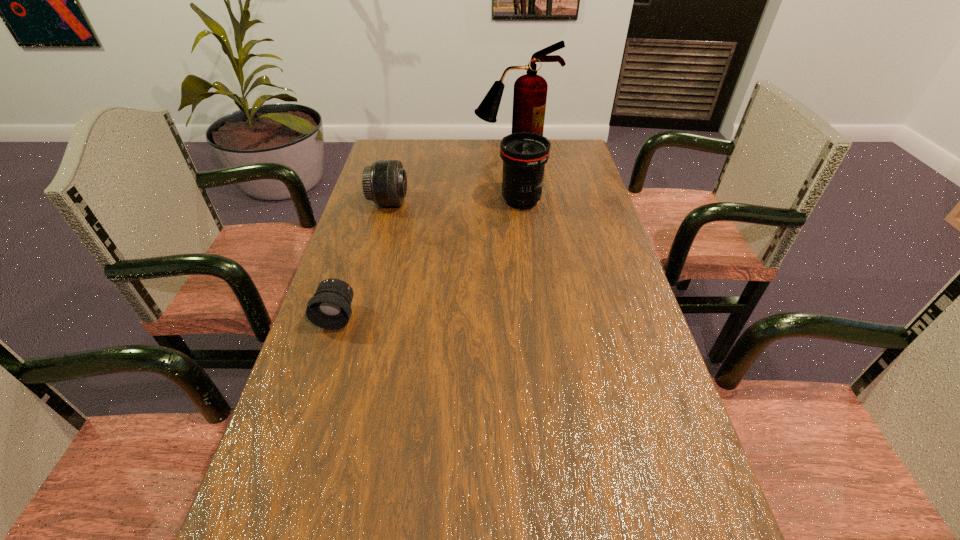
Where is `unoccupied area between the farthest object and the nearest object`? This screenshot has width=960, height=540. unoccupied area between the farthest object and the nearest object is located at coordinates (426, 233).

Locate an element on the screen. free spot between the nearest object and the tallest telephoto lens is located at coordinates (429, 259).

Find the location of `free area in between the second tallest telephoto lens and the shortest object`. free area in between the second tallest telephoto lens and the shortest object is located at coordinates (363, 259).

In order to click on free space between the nearest telephoto lens and the fire extinguisher in this screenshot , I will do `click(426, 233)`.

What are the coordinates of `object that is the second closest to the third tallest object` in the screenshot? It's located at (530, 90).

At what (x,y) coordinates should I click in order to perform the action: click on object that is the third closest to the rightmost telephoto lens. Please return your answer as a coordinate pair (x, y). The image size is (960, 540). Looking at the image, I should click on (330, 308).

I want to click on telephoto lens that stands as the closest to the shortest object, so click(385, 182).

This screenshot has height=540, width=960. Identify the location of telephoto lens that is the second closest one to the tallest object. (385, 182).

The height and width of the screenshot is (540, 960). I want to click on blank space that satisfies the following two spatial constraints: 1. at the nozzle of the farthest object; 2. on the front-facing side of the second tallest telephoto lens, so 521,202.

The height and width of the screenshot is (540, 960). I want to click on free spot that satisfies the following two spatial constraints: 1. on the front-facing side of the second tallest telephoto lens; 2. at the front element of the shortest object, so click(x=358, y=316).